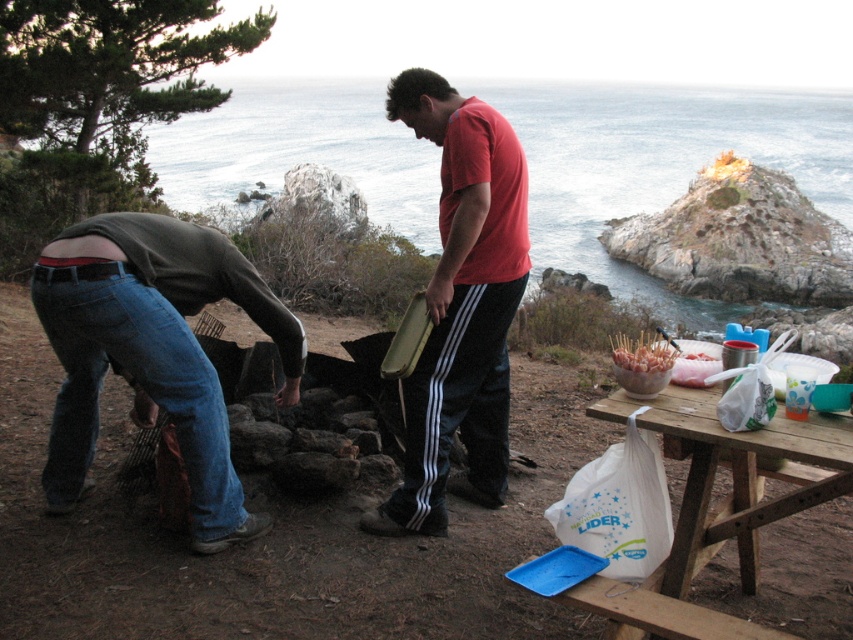
Does white plastic bag at lower right have a greater width compared to shiny metallic skewers at center?

Indeed, white plastic bag at lower right has a greater width compared to shiny metallic skewers at center.

Is point (666, 387) in front of point (653, 355)?

No.

Locate an element on the screen. white plastic bag at lower right is located at coordinates (733, 472).

Between green matte shirt at center and white plastic bag at lower right, which one appears on the left side from the viewer's perspective?

From the viewer's perspective, green matte shirt at center appears more on the left side.

Between green matte shirt at center and white plastic bag at lower right, which one is positioned lower?

white plastic bag at lower right

Does point (509, 204) lie in front of point (735, 516)?

No, it is not.

Find the location of a particular element. The width and height of the screenshot is (853, 640). green matte shirt at center is located at coordinates (459, 308).

Is the position of red matte t-shirt at center less distant than that of white plastic bag at lower right?

That is False.

Is point (422, 524) farther from camera compared to point (703, 512)?

Yes, it is.

Is point (471, 250) positioned after point (811, 490)?

Yes, it is.

Locate an element on the screen. This screenshot has width=853, height=640. red matte t-shirt at center is located at coordinates (460, 305).